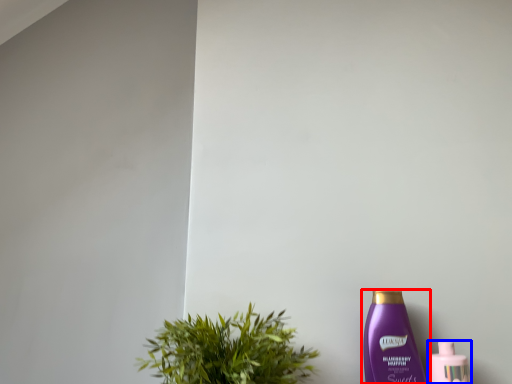
Question: Which of the following is the closest to the observer, bottle (highlighted by a red box) or bottle (highlighted by a blue box)?

Choices:
 (A) bottle
 (B) bottle

Answer: (A)